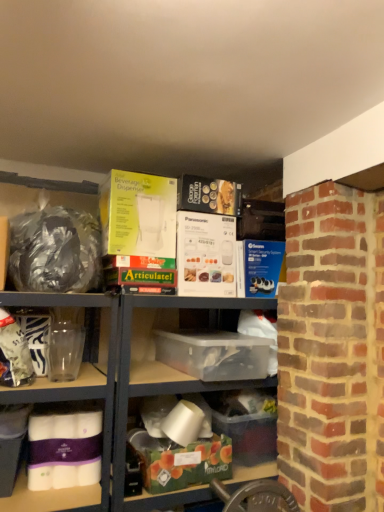
Question: Looking at their shapes, would you say transparent plastic box at center, the fourth box from the bottom, is wider or thinner than yellow cardboard beverage dispenser at upper center, the 5th box ordered from the bottom?

Choices:
 (A) wide
 (B) thin

Answer: (A)

Question: Considering the positions of transparent plastic box at center, the fourth box from the bottom, and yellow cardboard beverage dispenser at upper center, the 5th box ordered from the bottom, in the image, is transparent plastic box at center, the fourth box from the bottom, taller or shorter than yellow cardboard beverage dispenser at upper center, the 5th box ordered from the bottom,?

Choices:
 (A) tall
 (B) short

Answer: (B)

Question: Which object is the farthest from the clear plastic container at center?

Choices:
 (A) transparent plastic box at center, the fourth box from the bottom
 (B) purple matte tissue at lower left, the third box from the top
 (C) translucent plastic container at center, arranged as the fifth box when viewed from the top
 (D) yellow cardboard beverage dispenser at upper center, which ranks as the first box in top-to-bottom order
 (E) shiny metallic bag at left

Answer: (D)

Question: Which object is the farthest from the clear plastic container at center?

Choices:
 (A) yellow cardboard beverage dispenser at upper center, which ranks as the first box in top-to-bottom order
 (B) transparent plastic box at center, the fourth box from the bottom
 (C) purple matte tissue at lower left, the 3th box positioned from the bottom
 (D) shiny metallic bag at left
 (E) translucent plastic container at center, arranged as the fifth box when viewed from the top

Answer: (A)